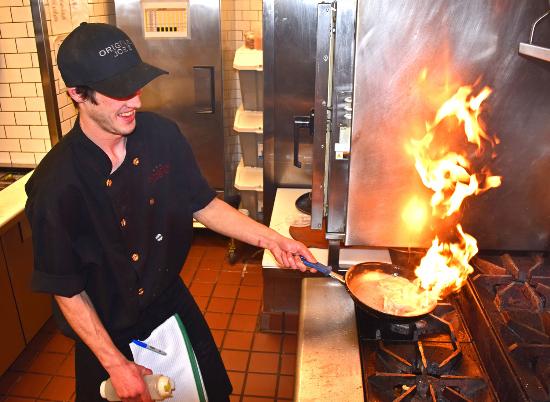
This screenshot has width=550, height=402. In order to click on burner in this screenshot , I will do [x=400, y=333], [x=426, y=375], [x=537, y=354], [x=537, y=288].